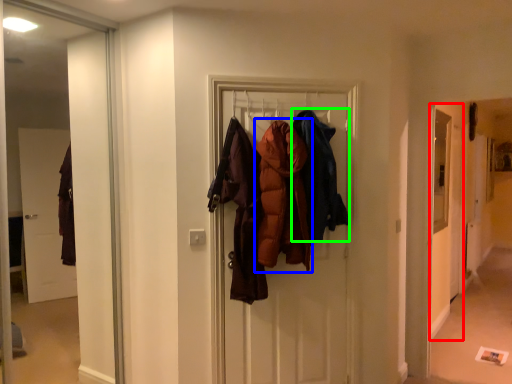
Question: Based on their relative distances, which object is farther from screen door (highlighted by a red box)? Choose from garment (highlighted by a blue box) and garment (highlighted by a green box).

Choices:
 (A) garment
 (B) garment

Answer: (A)